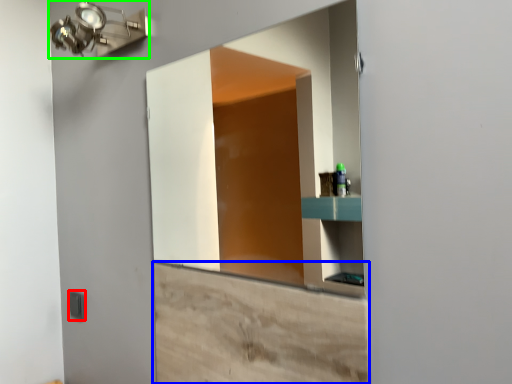
Question: Estimate the real-world distances between objects in this image. Which object is closer to light switch (highlighted by a red box), cabinetry (highlighted by a blue box) or light fixture (highlighted by a green box)?

Choices:
 (A) cabinetry
 (B) light fixture

Answer: (A)